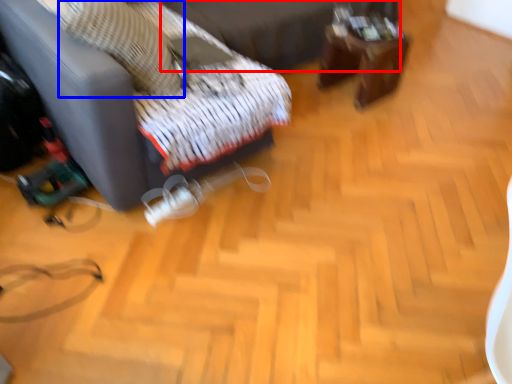
Question: Which of the following is the closest to the observer, bed frame (highlighted by a red box) or pillow (highlighted by a blue box)?

Choices:
 (A) bed frame
 (B) pillow

Answer: (B)